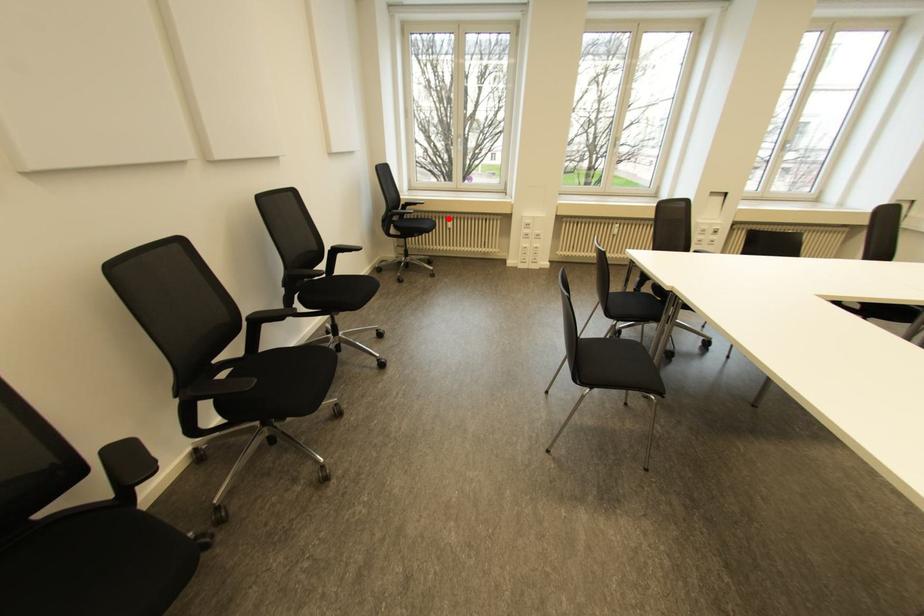
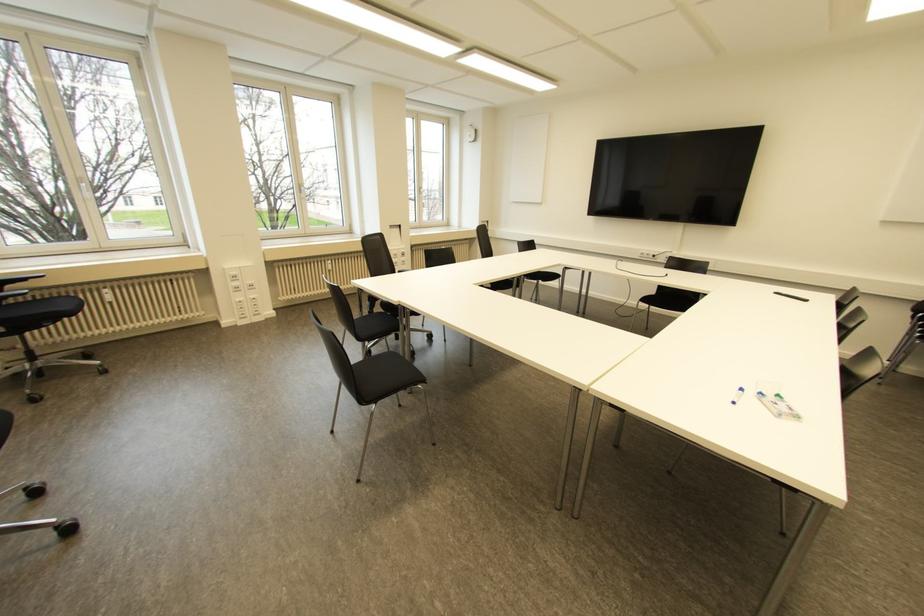
Question: I am providing you with two images of the same scene from different viewpoints. Given a red point in image1, look at the same physical point in image2. Is it:

Choices:
 (A) Closer to the viewpoint
 (B) Farther from the viewpoint

Answer: (B)